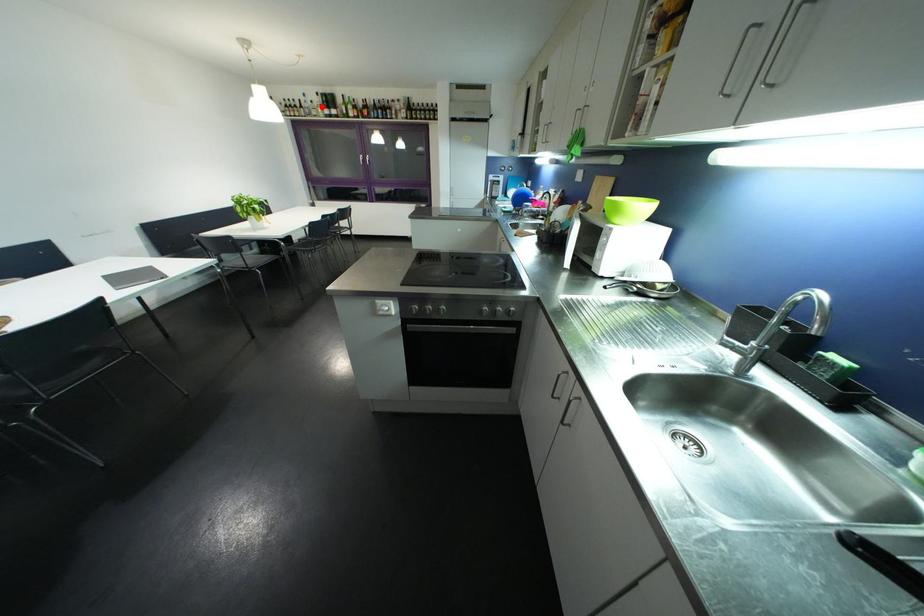
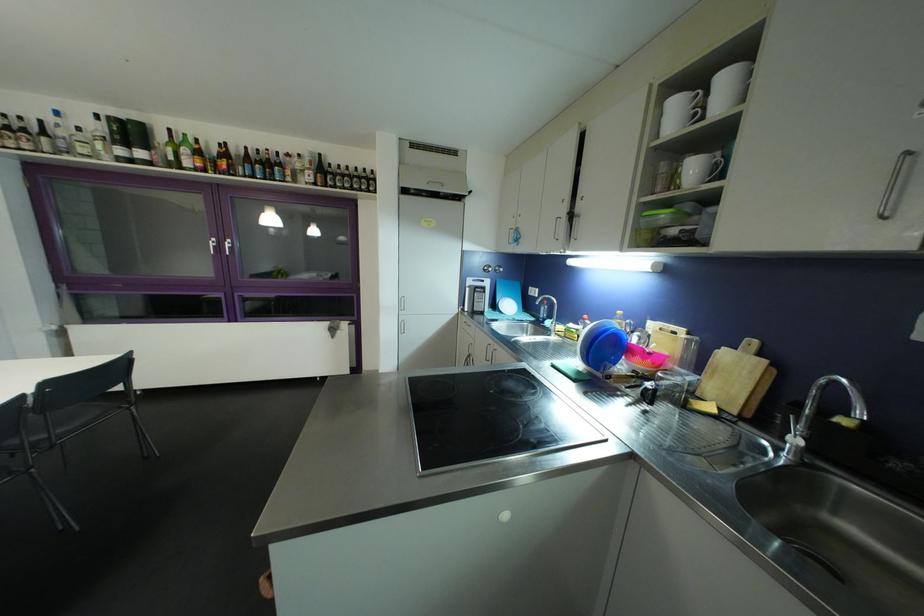
Where in the second image is the point corresponding to the highlighted location from the first image?

(94, 137)